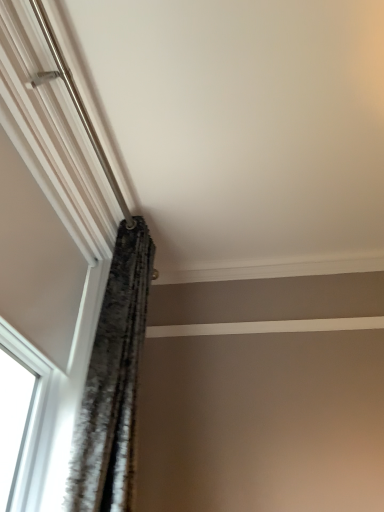
Question: Is white textured window at upper left in front of or behind velvet-like gray curtain at upper left in the image?

Choices:
 (A) behind
 (B) front

Answer: (B)

Question: Would you say white textured window at upper left is to the left or to the right of velvet-like gray curtain at upper left in the picture?

Choices:
 (A) right
 (B) left

Answer: (B)

Question: Looking at the image, does white textured window at upper left seem bigger or smaller compared to velvet-like gray curtain at upper left?

Choices:
 (A) big
 (B) small

Answer: (A)

Question: Is velvet-like gray curtain at upper left wider or thinner than white textured window at upper left?

Choices:
 (A) wide
 (B) thin

Answer: (A)

Question: Is velvet-like gray curtain at upper left in front of or behind white textured window at upper left in the image?

Choices:
 (A) front
 (B) behind

Answer: (B)

Question: Is point (79, 444) closer or farther from the camera than point (1, 317)?

Choices:
 (A) farther
 (B) closer

Answer: (A)

Question: In terms of height, does velvet-like gray curtain at upper left look taller or shorter compared to white textured window at upper left?

Choices:
 (A) short
 (B) tall

Answer: (B)